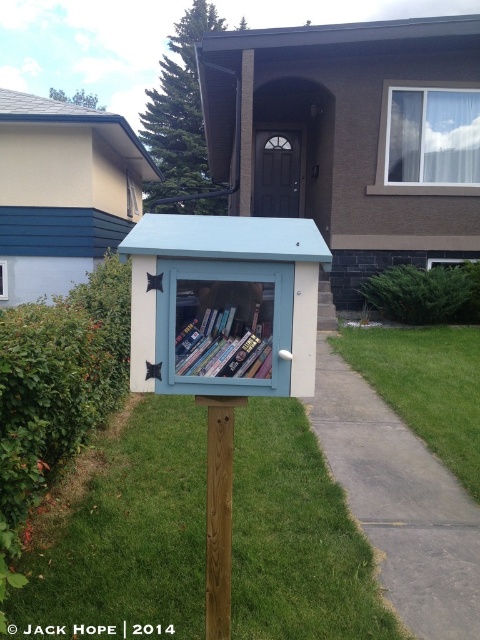
This screenshot has width=480, height=640. What do you see at coordinates (218, 512) in the screenshot?
I see `brown wooden post at center` at bounding box center [218, 512].

Who is more distant from viewer, (x=210, y=637) or (x=203, y=340)?

Positioned behind is point (x=210, y=637).

You are a GUI agent. You are given a task and a screenshot of the screen. Output one action in this format:
    pyautogui.click(x=<x>, y=<y>)
    Task: Click on the brown wooden post at center
    
    Given the screenshot: What is the action you would take?
    pyautogui.click(x=218, y=512)